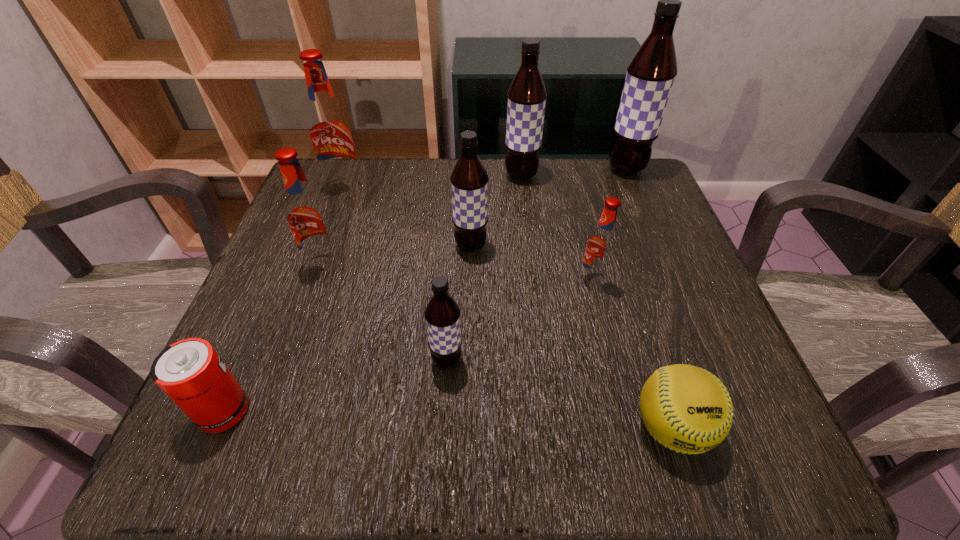
Where is `free space between the nearest brown root beer and the third smallest brown root beer`? free space between the nearest brown root beer and the third smallest brown root beer is located at coordinates [484, 268].

This screenshot has height=540, width=960. What are the coordinates of `free space that is in between the second smallest brown root beer and the farthest red root beer` in the screenshot? It's located at (408, 218).

This screenshot has width=960, height=540. Find the location of `empty space that is in between the second smallest brown root beer and the biggest red root beer`. empty space that is in between the second smallest brown root beer and the biggest red root beer is located at coordinates (408, 218).

The height and width of the screenshot is (540, 960). I want to click on vacant point located between the third root beer from right to left and the third farthest brown root beer, so click(x=496, y=211).

The width and height of the screenshot is (960, 540). I want to click on free space that is in between the biggest red root beer and the second biggest red root beer, so 334,227.

Image resolution: width=960 pixels, height=540 pixels. I want to click on object that is the fourth nearest to the farthest red root beer, so click(442, 313).

Choose which object is the nearest neighbor to the third biggest brown root beer. Please provide its 2D coordinates. Your answer should be formatted as a tuple, i.e. [(x, y)], where the tuple contains the x and y coordinates of a point satisfying the conditions above.

[(601, 246)]

Locate which root beer ranks sixth in proximity to the third farthest brown root beer. Please provide its 2D coordinates. Your answer should be formatted as a tuple, i.e. [(x, y)], where the tuple contains the x and y coordinates of a point satisfying the conditions above.

[(650, 75)]

Point out which root beer is positioned as the third nearest to the rightmost root beer. Please provide its 2D coordinates. Your answer should be formatted as a tuple, i.e. [(x, y)], where the tuple contains the x and y coordinates of a point satisfying the conditions above.

[(469, 180)]

Locate which brown root beer is the closest to the tallest object. Please provide its 2D coordinates. Your answer should be formatted as a tuple, i.e. [(x, y)], where the tuple contains the x and y coordinates of a point satisfying the conditions above.

[(527, 94)]